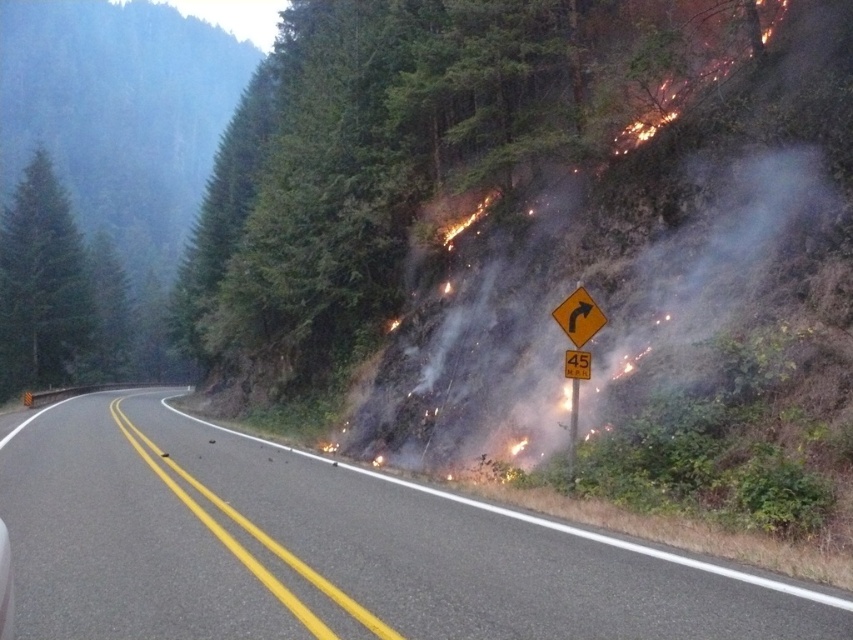
Question: Where is smoketransparentatright located in relation to yellow reflective diamond-shaped at center in the image?

Choices:
 (A) left
 (B) right

Answer: (B)

Question: Estimate the real-world distances between objects in this image. Which object is closer to the yellow plastic sign at center?

Choices:
 (A) yellow reflective diamond-shaped at center
 (B) black asphalt road at center
 (C) yellow plastic diamond-shaped sign at center-right
 (D) smoketransparentatright

Answer: (C)

Question: Is black asphalt road at center closer to the viewer compared to yellow plastic diamond-shaped sign at center-right?

Choices:
 (A) yes
 (B) no

Answer: (A)

Question: Among these points, which one is nearest to the camera?

Choices:
 (A) (776, 317)
 (B) (556, 307)
 (C) (577, 388)
 (D) (276, 515)

Answer: (D)

Question: Is yellow plastic diamond-shaped sign at center-right positioned behind yellow reflective diamond-shaped at center?

Choices:
 (A) no
 (B) yes

Answer: (A)

Question: Which object is closer to the camera taking this photo?

Choices:
 (A) black asphalt road at center
 (B) yellow plastic diamond-shaped sign at center-right
 (C) yellow reflective diamond-shaped at center
 (D) yellow plastic sign at center

Answer: (A)